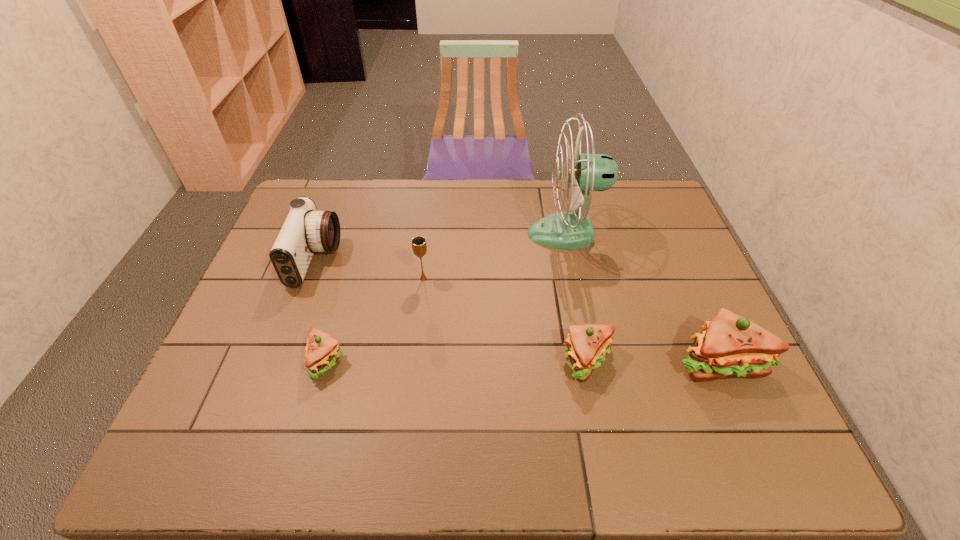
Find the location of a particular element. Image resolution: width=960 pixels, height=540 pixels. free space located 0.110m on the left of the rightmost sandwich is located at coordinates (627, 362).

Where is `free space located 0.230m on the left of the chalice`? The image size is (960, 540). free space located 0.230m on the left of the chalice is located at coordinates point(336,279).

The image size is (960, 540). What are the coordinates of `free spot located in front of the tallest object, directing airflow` in the screenshot? It's located at (433, 234).

What are the coordinates of `vacant space located 0.240m in front of the tallest object, directing airflow` in the screenshot? It's located at (452, 234).

The height and width of the screenshot is (540, 960). I want to click on vacant space situated in front of the tallest object, directing airflow, so click(411, 234).

In order to click on free spot located 0.240m on the surface of the leftmost object in this screenshot , I will do `click(417, 260)`.

Identify the location of object that is at the far edge. The width and height of the screenshot is (960, 540). (572, 229).

At what (x,y) coordinates should I click in order to perform the action: click on object present at the left edge. Please return your answer as a coordinate pair (x, y). The image size is (960, 540). Looking at the image, I should click on (305, 231).

Where is `object that is at the right edge`? This screenshot has width=960, height=540. object that is at the right edge is located at coordinates (730, 346).

Image resolution: width=960 pixels, height=540 pixels. What are the coordinates of `object that is at the near right corner` in the screenshot? It's located at 730,346.